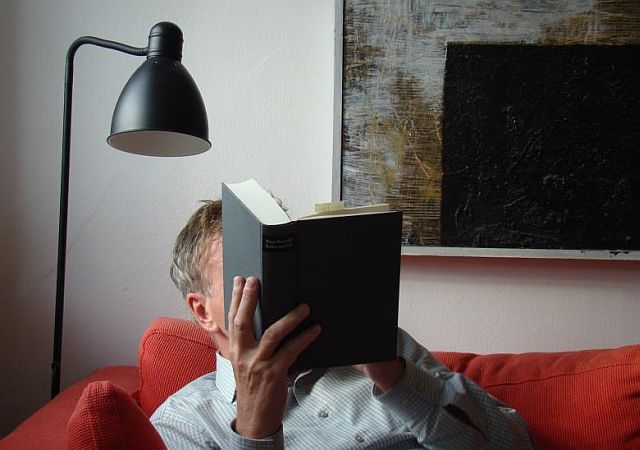
At what (x,y) coordinates should I click in order to perform the action: click on painting frame. Please return your answer as a coordinate pair (x, y). Looking at the image, I should click on (498, 251), (338, 34).